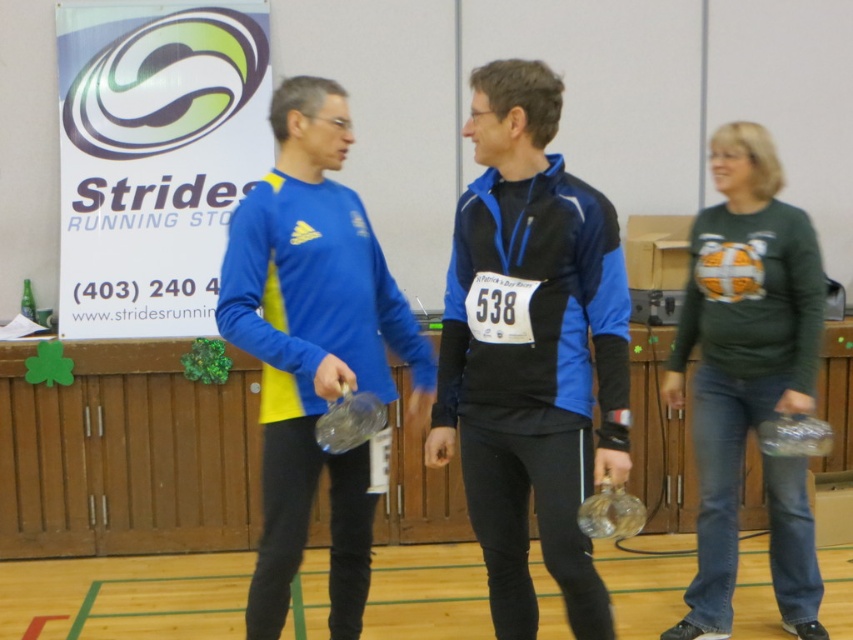
Is blue matte jacket at center taller than green jersey at right?

No.

Is blue matte jacket at center shorter than green jersey at right?

Indeed, blue matte jacket at center has a lesser height compared to green jersey at right.

Which is behind, point (474, 227) or point (751, 253)?

Positioned behind is point (751, 253).

The width and height of the screenshot is (853, 640). In order to click on blue matte jacket at center in this screenshot , I will do `click(531, 349)`.

Who is positioned more to the left, blue matte long-sleeve shirt at center or green jersey at right?

blue matte long-sleeve shirt at center

Who is more forward, (323,221) or (802,512)?

Positioned in front is point (323,221).

Identify the location of blue matte long-sleeve shirt at center. The height and width of the screenshot is (640, 853). (312, 346).

This screenshot has width=853, height=640. Find the location of `blue matte long-sleeve shirt at center`. blue matte long-sleeve shirt at center is located at coordinates (312, 346).

Is blue matte jacket at center bigger than blue matte long-sleeve shirt at center?

No, blue matte jacket at center is not bigger than blue matte long-sleeve shirt at center.

The width and height of the screenshot is (853, 640). I want to click on blue matte jacket at center, so click(x=531, y=349).

Find the location of `blue matte jacket at center`. blue matte jacket at center is located at coordinates (531, 349).

Find the location of a particular element. blue matte jacket at center is located at coordinates (531, 349).